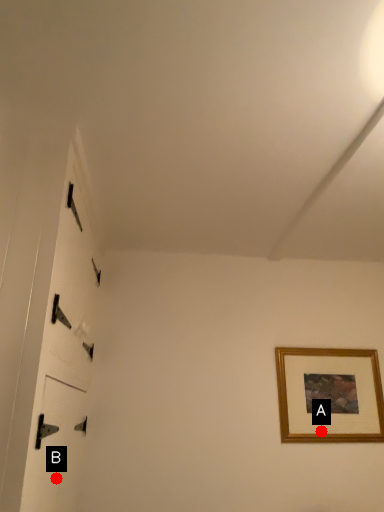
Question: Two points are circled on the image, labeled by A and B beside each circle. Among these points, which one is farthest from the camera?

Choices:
 (A) A is further
 (B) B is further

Answer: (A)